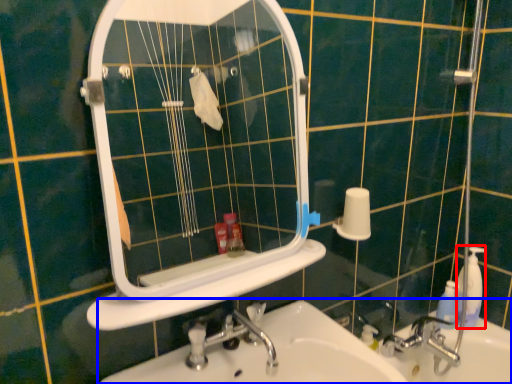
Question: Which point is closer to the camera, soap dispenser (highlighted by a red box) or sink (highlighted by a blue box)?

Choices:
 (A) soap dispenser
 (B) sink

Answer: (B)